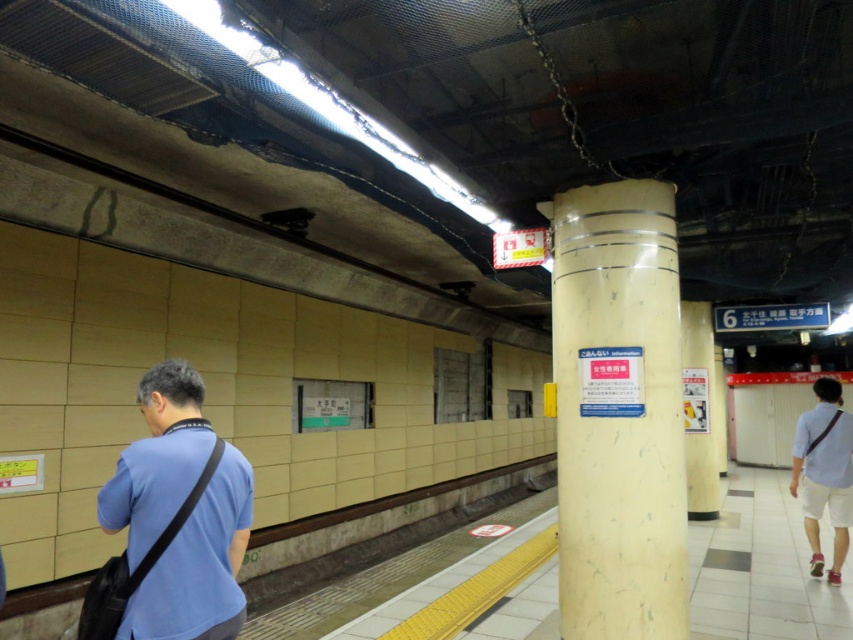
Based on the photo, between yellow matte pillar at center and blue fabric bag at left, which one appears on the left side from the viewer's perspective?

blue fabric bag at left

Can you confirm if yellow matte pillar at center is smaller than blue fabric bag at left?

No.

Image resolution: width=853 pixels, height=640 pixels. In order to click on yellow matte pillar at center in this screenshot , I will do `click(618, 413)`.

At what (x,y) coordinates should I click in order to perform the action: click on yellow matte pillar at center. Please return your answer as a coordinate pair (x, y). Looking at the image, I should click on (618, 413).

Is yellow matte pillar at center bigger than white cotton shorts at right?

Indeed, yellow matte pillar at center has a larger size compared to white cotton shorts at right.

Between yellow matte pillar at center and white cotton shorts at right, which one is positioned higher?

yellow matte pillar at center is higher up.

Is point (627, 438) positioned in front of point (804, 424)?

Yes.

Identify the location of yellow matte pillar at center. Image resolution: width=853 pixels, height=640 pixels. (618, 413).

Does blue fabric bag at left have a lesser width compared to white cotton shorts at right?

Yes, blue fabric bag at left is thinner than white cotton shorts at right.

Between blue fabric bag at left and white cotton shorts at right, which one has more height?

With more height is white cotton shorts at right.

This screenshot has width=853, height=640. I want to click on blue fabric bag at left, so click(x=199, y=564).

Where is `blue fabric bag at left`? This screenshot has width=853, height=640. blue fabric bag at left is located at coordinates (199, 564).